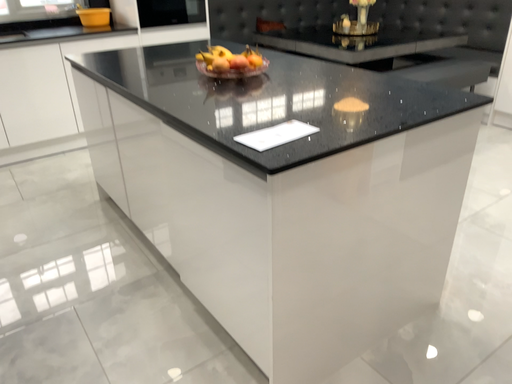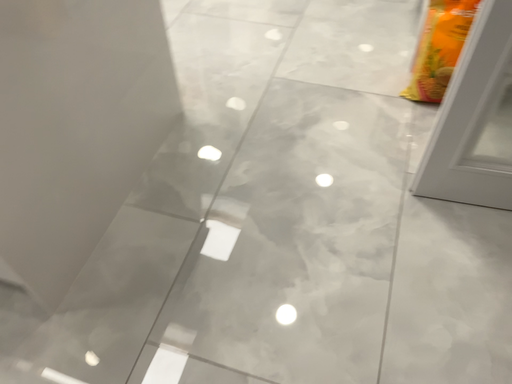
Question: How did the camera likely rotate when shooting the video?

Choices:
 (A) rotated left
 (B) rotated right

Answer: (B)